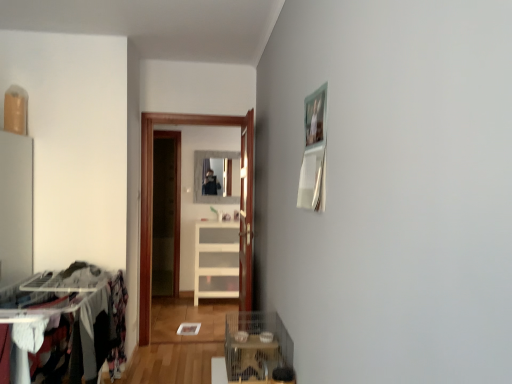
Where is `vacant space situated above metallic wire cage at lower center (from a real-world perspective)`? Image resolution: width=512 pixels, height=384 pixels. vacant space situated above metallic wire cage at lower center (from a real-world perspective) is located at coordinates (257, 355).